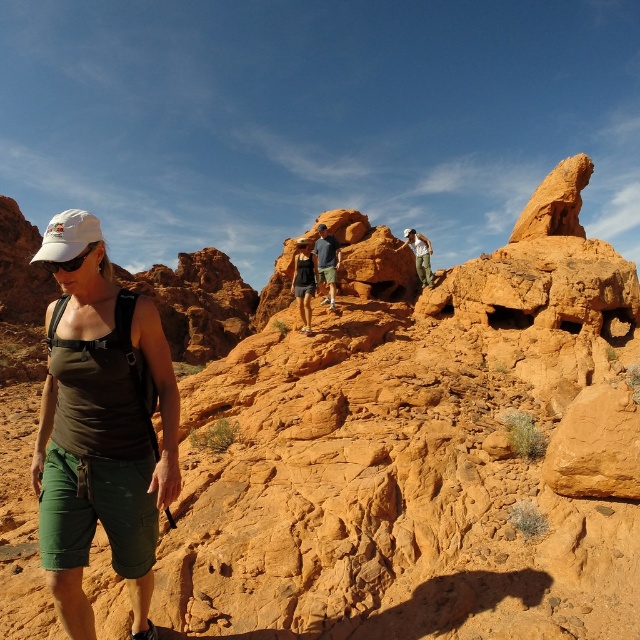
Based on the scene description, can you determine which clothing item, the matte black tank top at center or the matte khaki pants at center, is positioned higher on the person?

The matte black tank top at center is taller than the matte khaki pants at center, so the tank top is positioned higher on the person.

You are a photographer trying to capture the hiker in the desert scene. The hiker is wearing a matte black tank top at center and matte khaki pants at center. Since you want to highlight the clothing items, which clothing item would appear narrower in your photo?

The matte black tank top at center is thinner than the matte khaki pants at center, so it would appear narrower in the photo.